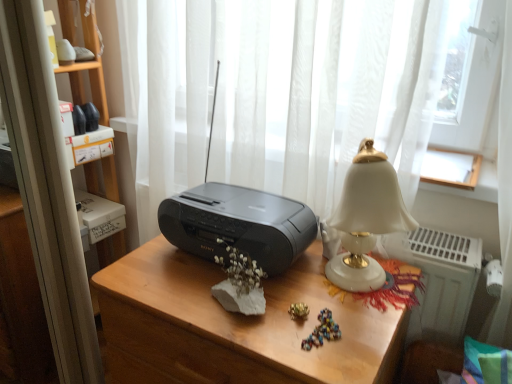
This screenshot has height=384, width=512. I want to click on empty space that is ontop of matte black radio at center (from a real-world perspective), so click(257, 299).